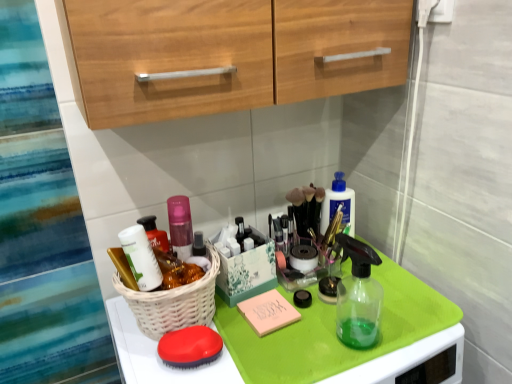
Question: Does matte white container at center left contain matte red brush at lower center?

Choices:
 (A) no
 (B) yes

Answer: (A)

Question: Is matte white container at center left to the left of matte red brush at lower center from the viewer's perspective?

Choices:
 (A) no
 (B) yes

Answer: (B)

Question: From the image's perspective, is matte white container at center left above matte red brush at lower center?

Choices:
 (A) yes
 (B) no

Answer: (A)

Question: From the image's perspective, does matte white container at center left appear lower than matte red brush at lower center?

Choices:
 (A) no
 (B) yes

Answer: (A)

Question: Is matte white container at center left in contact with matte red brush at lower center?

Choices:
 (A) yes
 (B) no

Answer: (B)

Question: Is white wicker basket at center inside or outside of matte red brush at lower center?

Choices:
 (A) outside
 (B) inside

Answer: (A)

Question: Looking at the image, does white wicker basket at center seem bigger or smaller compared to matte red brush at lower center?

Choices:
 (A) small
 (B) big

Answer: (B)

Question: Is white wicker basket at center taller or shorter than matte red brush at lower center?

Choices:
 (A) tall
 (B) short

Answer: (A)

Question: Would you say white wicker basket at center is to the left or to the right of matte red brush at lower center in the picture?

Choices:
 (A) right
 (B) left

Answer: (B)

Question: In terms of width, does matte red brush at lower center look wider or thinner when compared to matte white container at center left?

Choices:
 (A) wide
 (B) thin

Answer: (A)

Question: Considering the relative positions of matte red brush at lower center and matte white container at center left in the image provided, is matte red brush at lower center to the left or to the right of matte white container at center left?

Choices:
 (A) right
 (B) left

Answer: (A)

Question: Is point (169, 359) positioned closer to the camera than point (147, 243)?

Choices:
 (A) farther
 (B) closer

Answer: (B)

Question: Is matte red brush at lower center taller or shorter than matte white container at center left?

Choices:
 (A) tall
 (B) short

Answer: (B)

Question: Based on their positions, is matte red brush at lower center located to the left or right of white wicker basket at center?

Choices:
 (A) left
 (B) right

Answer: (B)

Question: Considering their positions, is matte red brush at lower center located in front of or behind white wicker basket at center?

Choices:
 (A) behind
 (B) front

Answer: (A)